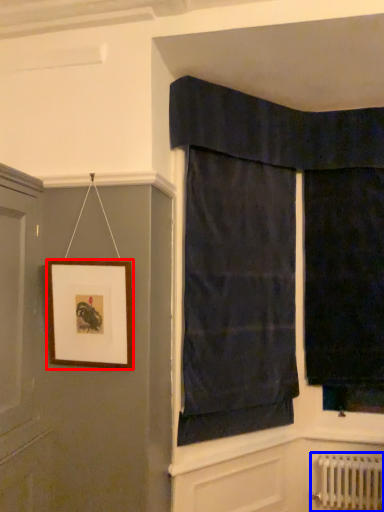
Question: Which point is closer to the camera, picture frame (highlighted by a red box) or radiator (highlighted by a blue box)?

Choices:
 (A) picture frame
 (B) radiator

Answer: (A)